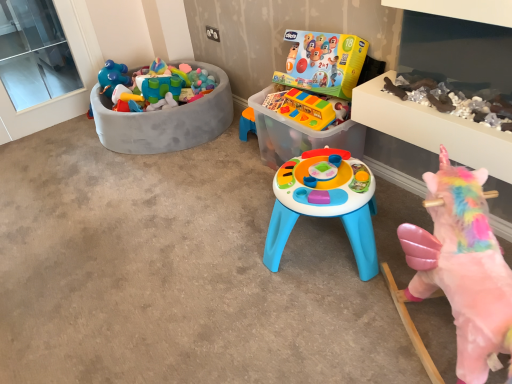
Question: Is plastic toy bin at left, the fourth toy in the right-to-left sequence, taller than translucent plastic toy at center, marked as the third toy in a left-to-right arrangement?

Choices:
 (A) no
 (B) yes

Answer: (B)

Question: Is plastic toy bin at left, which is the 1th toy from left to right, facing towards translucent plastic toy at center, marked as the 2th toy in a right-to-left arrangement?

Choices:
 (A) no
 (B) yes

Answer: (A)

Question: Is there a large distance between plastic toy bin at left, positioned as the first toy in back-to-front order, and translucent plastic toy at center, marked as the third toy in a left-to-right arrangement?

Choices:
 (A) no
 (B) yes

Answer: (A)

Question: From a real-world perspective, is plastic toy bin at left, the 4th toy in the front-to-back sequence, physically above translucent plastic toy at center, marked as the third toy in a left-to-right arrangement?

Choices:
 (A) no
 (B) yes

Answer: (A)

Question: Is translucent plastic toy at center, arranged as the 2th toy when viewed from the back, located within plastic toy bin at left, positioned as the first toy in back-to-front order?

Choices:
 (A) no
 (B) yes

Answer: (A)

Question: Is rubberized yellow toy bus at center, which is counted as the 2th toy, starting from the left, in front of or behind translucent plastic toy at center, arranged as the 3th toy when viewed from the front, in the image?

Choices:
 (A) front
 (B) behind

Answer: (A)

Question: From the image's perspective, relative to translucent plastic toy at center, arranged as the 3th toy when viewed from the front, is rubberized yellow toy bus at center, the second toy positioned from the front, above or below?

Choices:
 (A) above
 (B) below

Answer: (A)

Question: Considering the positions of point tap(312, 110) and point tap(250, 97), is point tap(312, 110) closer or farther from the camera than point tap(250, 97)?

Choices:
 (A) farther
 (B) closer

Answer: (B)

Question: Visually, is rubberized yellow toy bus at center, which is counted as the 2th toy, starting from the left, positioned to the left or to the right of translucent plastic toy at center, arranged as the 3th toy when viewed from the front?

Choices:
 (A) right
 (B) left

Answer: (B)

Question: Considering the positions of point (460, 299) and point (50, 67), is point (460, 299) closer or farther from the camera than point (50, 67)?

Choices:
 (A) farther
 (B) closer

Answer: (B)

Question: In terms of height, does pink fabric unicorn at lower right, which appears as the first toy when viewed from the front, look taller or shorter compared to transparent glass window at upper left?

Choices:
 (A) short
 (B) tall

Answer: (A)

Question: Is pink fabric unicorn at lower right, which ranks as the fourth toy in left-to-right order, bigger or smaller than transparent glass window at upper left?

Choices:
 (A) small
 (B) big

Answer: (B)

Question: From a real-world perspective, is pink fabric unicorn at lower right, which ranks as the fourth toy in left-to-right order, physically located above or below transparent glass window at upper left?

Choices:
 (A) above
 (B) below

Answer: (B)

Question: From a real-world perspective, is rubberized yellow toy bus at center, the second toy positioned from the front, positioned above or below pink fabric unicorn at lower right, placed as the fourth toy when sorted from back to front?

Choices:
 (A) above
 (B) below

Answer: (A)

Question: Looking at their shapes, would you say rubberized yellow toy bus at center, the second toy positioned from the front, is wider or thinner than pink fabric unicorn at lower right, the first toy from the right?

Choices:
 (A) thin
 (B) wide

Answer: (A)